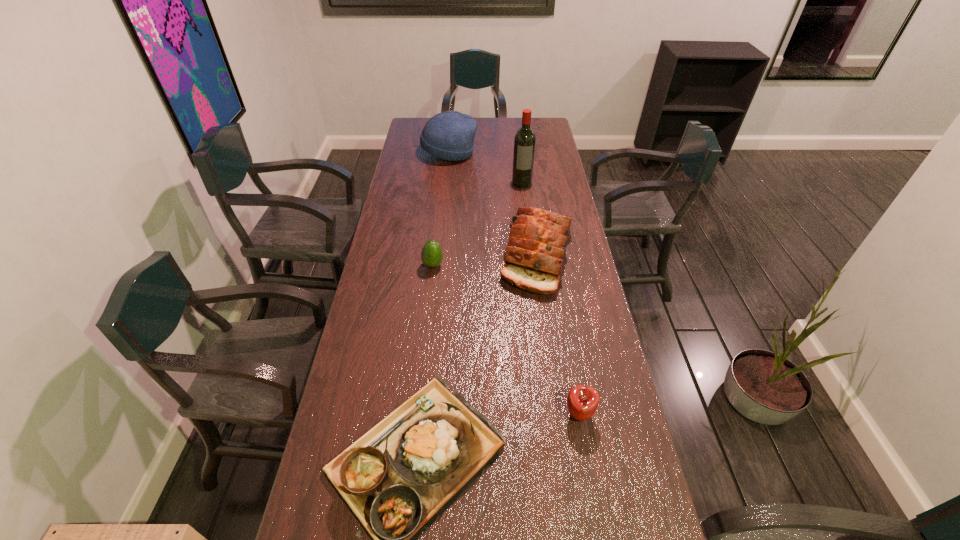
This screenshot has width=960, height=540. I want to click on the fifth nearest object, so click(524, 143).

Where is `wine bottle`? wine bottle is located at coordinates (524, 143).

The width and height of the screenshot is (960, 540). Find the location of `the second tallest object`. the second tallest object is located at coordinates (449, 135).

Locate an element on the screen. The height and width of the screenshot is (540, 960). skullcap is located at coordinates (449, 135).

Identify the location of bread. This screenshot has height=540, width=960. (534, 255).

You are a GUI agent. You are given a task and a screenshot of the screen. Output one action in this format:
    pyautogui.click(x=<x>, y=<y>)
    Task: Click on the avocado
    The width and height of the screenshot is (960, 540).
    Given the screenshot: What is the action you would take?
    tap(432, 255)

Where is `apple`? The image size is (960, 540). apple is located at coordinates (582, 401).

Locate an element on the screen. free space located on the label of the tallest object is located at coordinates click(x=526, y=219).

Identify the location of free space located 0.080m on the left of the skullcap. (405, 153).

You are a GUI agent. You are given a task and a screenshot of the screen. Output one action in this format:
    pyautogui.click(x=<x>, y=<y>)
    Task: Click on the vacant space located on the front of the third tallest object
    The width and height of the screenshot is (960, 540).
    Given the screenshot: What is the action you would take?
    pyautogui.click(x=553, y=368)